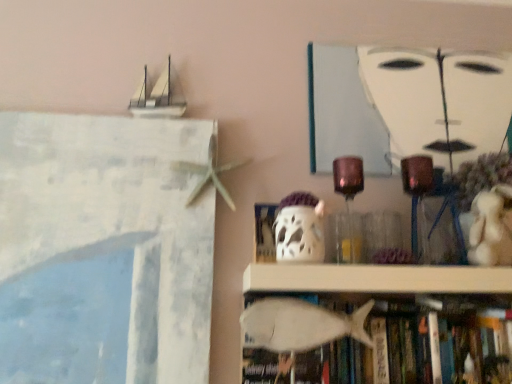
Measure the distance between white matte ghost at center and camera.

They are 88.87 centimeters apart.

Locate an element on the screen. The image size is (512, 384). white matte ghost at center is located at coordinates (300, 228).

The height and width of the screenshot is (384, 512). Describe the element at coordinates (439, 101) in the screenshot. I see `white matte painting at upper center` at that location.

Locate an element on the screen. The image size is (512, 384). white matte fish at lower center is located at coordinates (376, 279).

Describe the element at coordinates (377, 339) in the screenshot. I see `white matte fish at lower center` at that location.

Locate an element on the screen. The image size is (512, 384). white matte ghost at center is located at coordinates (300, 228).

This screenshot has width=512, height=384. I want to click on human face on the right of the white matte ghost at center, so click(x=439, y=101).

Are white matte painting at upper center and white matte ghost at center located far from each other?

No, white matte painting at upper center is not far away from white matte ghost at center.

Does white matte painting at upper center have a lesser width compared to white matte ghost at center?

Yes, white matte painting at upper center is thinner than white matte ghost at center.

Based on the photo, can you tell me how much white matte painting at upper center and white matte ghost at center differ in facing direction?

There is a 1.08-degree angle between the facing directions of white matte painting at upper center and white matte ghost at center.

Which of these two, white matte fish at lower center or white matte fish at lower center, is bigger?

white matte fish at lower center.

Visually, is white matte fish at lower center positioned to the left or to the right of white matte fish at lower center?

From the image, it's evident that white matte fish at lower center is to the left of white matte fish at lower center.

The height and width of the screenshot is (384, 512). What are the coordinates of `animal below the white matte fish at lower center (from a real-world perspective)` in the screenshot? It's located at (300, 325).

Considering the positions of points (328, 332) and (420, 267), is point (328, 332) farther from camera compared to point (420, 267)?

No.

Is white matte fish at lower center taller or shorter than white matte fish at lower center?

Considering their sizes, white matte fish at lower center has more height than white matte fish at lower center.

Between white matte fish at lower center and white matte fish at lower center, which one has larger size?

Bigger between the two is white matte fish at lower center.

From the image's perspective, relative to white matte fish at lower center, is white matte fish at lower center above or below?

Clearly, from the image's perspective, white matte fish at lower center is below white matte fish at lower center.

Which is more to the left, white matte fish at lower center or white plush bear at right?

Positioned to the left is white matte fish at lower center.

Is white matte fish at lower center situated inside white plush bear at right or outside?

white matte fish at lower center exists outside the volume of white plush bear at right.

Is the surface of white matte fish at lower center in direct contact with white plush bear at right?

They are not placed beside each other.

From a real-world perspective, who is located higher, white matte fish at lower center or white plush bear at right?

From a 3D spatial view, white plush bear at right is above.

Between point (275, 350) and point (279, 216), which one is positioned in front?

The point (275, 350) is closer to the camera.

Looking at this image, who is bigger, white matte fish at lower center or white matte ghost at center?

white matte fish at lower center is bigger.

Locate an element on the screen. This screenshot has width=512, height=384. animal on the right of white matte ghost at center is located at coordinates (300, 325).

From the image's perspective, who appears lower, white matte fish at lower center or white matte ghost at center?

white matte fish at lower center is shown below in the image.

Which point is more distant from viewer, [489,213] or [318,208]?

The point [489,213] is farther from the camera.

Is white plush bear at right thinner than white matte ghost at center?

Incorrect, the width of white plush bear at right is not less than that of white matte ghost at center.

How much distance is there between white plush bear at right and white matte ghost at center?

14.73 inches.

Is white plush bear at right taller or shorter than white matte ghost at center?

white plush bear at right is taller than white matte ghost at center.

Between white matte fish at lower center and white plush bear at right, which one has larger size?

white matte fish at lower center is bigger.

Between point (329, 289) and point (504, 220), which one is positioned behind?

The point (504, 220) is more distant.

Could you tell me if white matte fish at lower center is turned towards white plush bear at right?

No, white matte fish at lower center is not turned towards white plush bear at right.

Find the location of a particular element. human face positioned vertically above the white matte ghost at center (from a real-world perspective) is located at coordinates (439, 101).

The image size is (512, 384). In order to click on book that is on the right side of white matte fish at lower center in this screenshot , I will do `click(377, 339)`.

Based on their spatial positions, is white matte ghost at center or white matte fish at lower center further from white plush bear at right?

white matte ghost at center is positioned further to the anchor white plush bear at right.

Considering their positions, is white matte painting at upper center positioned further to white matte fish at lower center than white matte ghost at center?

Among the two, white matte painting at upper center is located further to white matte fish at lower center.

Looking at the image, which one is located further to white matte fish at lower center, white matte painting at upper center or white matte fish at lower center?

Among the two, white matte painting at upper center is located further to white matte fish at lower center.

Estimate the real-world distances between objects in this image. Which object is further from white matte fish at lower center, white matte painting at upper center or white matte fish at lower center?

white matte painting at upper center is positioned further to the anchor white matte fish at lower center.

When comparing their distances from white plush bear at right, does white matte ghost at center or white matte fish at lower center seem closer?

white matte fish at lower center.

Looking at this image, considering their positions, is white plush bear at right positioned further to white matte ghost at center than white matte fish at lower center?

white plush bear at right.

Considering their positions, is white plush bear at right positioned closer to white matte ghost at center than white matte fish at lower center?

The object closer to white matte ghost at center is white matte fish at lower center.

Looking at the image, which one is located further to white matte painting at upper center, white matte ghost at center or white matte fish at lower center?

white matte fish at lower center is further to white matte painting at upper center.

Where is `toy between white matte painting at upper center and white matte fish at lower center from top to bottom`? toy between white matte painting at upper center and white matte fish at lower center from top to bottom is located at coordinates (490, 228).

At what (x,y) coordinates should I click in order to perform the action: click on animal situated between white matte ghost at center and white matte fish at lower center from left to right. Please return your answer as a coordinate pair (x, y). The image size is (512, 384). Looking at the image, I should click on (300, 325).

Where is `book between white matte ghost at center and white plush bear at right from left to right`? Image resolution: width=512 pixels, height=384 pixels. book between white matte ghost at center and white plush bear at right from left to right is located at coordinates (377, 339).

You are a GUI agent. You are given a task and a screenshot of the screen. Output one action in this format:
    pyautogui.click(x=<x>, y=<y>)
    Task: Click on the ghost between white matte painting at upper center and white matte fish at lower center from top to bottom
    
    Given the screenshot: What is the action you would take?
    pyautogui.click(x=300, y=228)